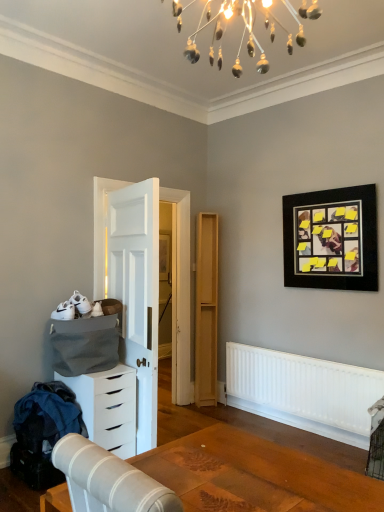
Question: Considering the relative positions of white matte radiator at lower right and white matte chest of drawers at lower left in the image provided, is white matte radiator at lower right in front of white matte chest of drawers at lower left?

Choices:
 (A) no
 (B) yes

Answer: (A)

Question: Can you confirm if white matte radiator at lower right is positioned to the right of white matte chest of drawers at lower left?

Choices:
 (A) no
 (B) yes

Answer: (B)

Question: Considering the relative sizes of white matte radiator at lower right and white matte chest of drawers at lower left in the image provided, is white matte radiator at lower right taller than white matte chest of drawers at lower left?

Choices:
 (A) yes
 (B) no

Answer: (B)

Question: Is white matte radiator at lower right located outside white matte chest of drawers at lower left?

Choices:
 (A) yes
 (B) no

Answer: (A)

Question: Does white matte radiator at lower right turn towards white matte chest of drawers at lower left?

Choices:
 (A) yes
 (B) no

Answer: (A)

Question: Would you consider white matte radiator at lower right to be distant from white matte chest of drawers at lower left?

Choices:
 (A) yes
 (B) no

Answer: (A)

Question: Can you confirm if light wood/file cabinet at center is positioned to the right of white matte chest of drawers at lower left?

Choices:
 (A) yes
 (B) no

Answer: (A)

Question: Is light wood/file cabinet at center oriented towards white matte chest of drawers at lower left?

Choices:
 (A) yes
 (B) no

Answer: (B)

Question: Is light wood/file cabinet at center shorter than white matte chest of drawers at lower left?

Choices:
 (A) no
 (B) yes

Answer: (A)

Question: Considering the relative sizes of light wood/file cabinet at center and white matte chest of drawers at lower left in the image provided, is light wood/file cabinet at center bigger than white matte chest of drawers at lower left?

Choices:
 (A) yes
 (B) no

Answer: (B)

Question: Is there a large distance between light wood/file cabinet at center and white matte chest of drawers at lower left?

Choices:
 (A) yes
 (B) no

Answer: (A)

Question: From a real-world perspective, is light wood/file cabinet at center below white matte chest of drawers at lower left?

Choices:
 (A) no
 (B) yes

Answer: (A)

Question: Could you tell me if wooden table at lower center is turned towards white matte chest of drawers at lower left?

Choices:
 (A) yes
 (B) no

Answer: (B)